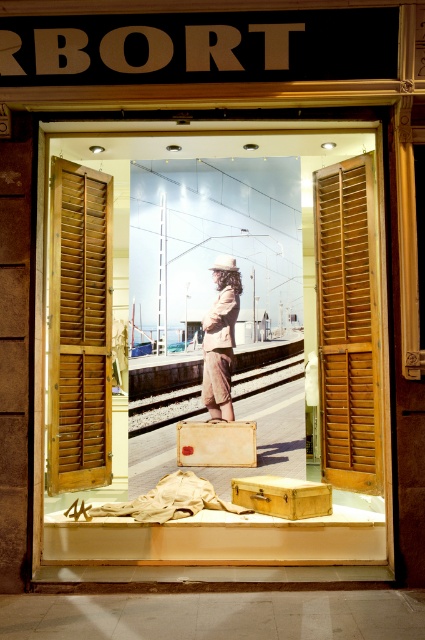
You are a delivery person who needs to place a 30 inch wide package between the wooden at right and the metallic train track at center in the shop window. Can the package fit between them without overlapping either object?

The wooden at right and metallic train track at center are 28.70 inches apart from each other. Since the package is 30 inches wide, which is wider than the 28.70 inches space between them, the package cannot fit between the two objects without overlapping.

Based on the scene description, where is the wooden shutters at left located in the image?

The wooden shutters at left are located at point [79,328] in the image.

You are a delivery person trying to place a large package in the shop window. The package is the size of the wooden shutters at left. Can you fit another package the size of the light brown fabric coat at center next to it without overlapping?

The wooden shutters at left has a larger size compared to light brown fabric coat at center, so there might not be enough space to place another package of the light brown fabric coat at center next to it without overlapping. Check the available space carefully.